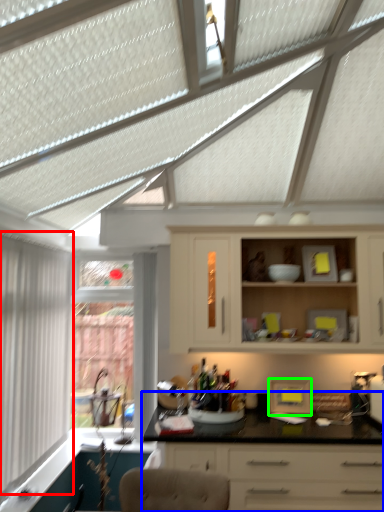
Question: Which object is positioned closest to window (highlighted by a red box)? Select from countertop (highlighted by a blue box) and appliance (highlighted by a green box).

Choices:
 (A) countertop
 (B) appliance

Answer: (A)